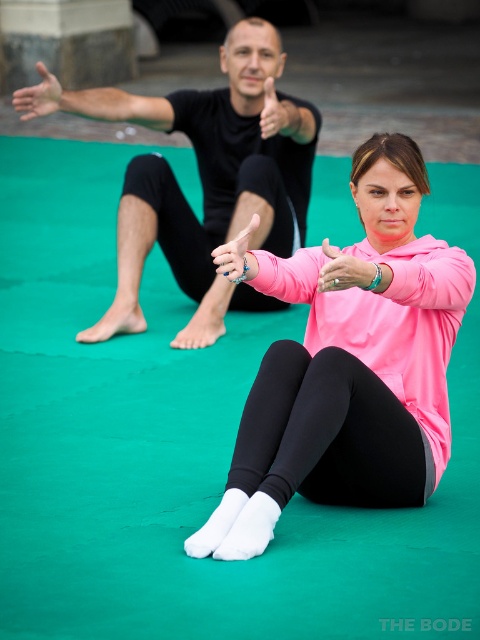
Question: From the image, what is the correct spatial relationship of black matte/black leggings at upper center in relation to silver metallic ring at center?

Choices:
 (A) below
 (B) above

Answer: (B)

Question: Which of these objects is positioned farthest from the pink matte hoodie at center?

Choices:
 (A) pink matte wristband at center
 (B) silver metallic ring at center

Answer: (B)

Question: Can you confirm if silver metallic ring at center is positioned below matte black hand at upper center?

Choices:
 (A) no
 (B) yes

Answer: (B)

Question: Which point appears closest to the camera in this image?

Choices:
 (A) (259, 461)
 (B) (382, 285)

Answer: (B)

Question: Which object is farther from the camera taking this photo?

Choices:
 (A) black matte/black leggings at upper center
 (B) pink matte wristband at center

Answer: (A)

Question: Can you confirm if pink matte hoodie at center is bigger than matte black hand at upper center?

Choices:
 (A) yes
 (B) no

Answer: (A)